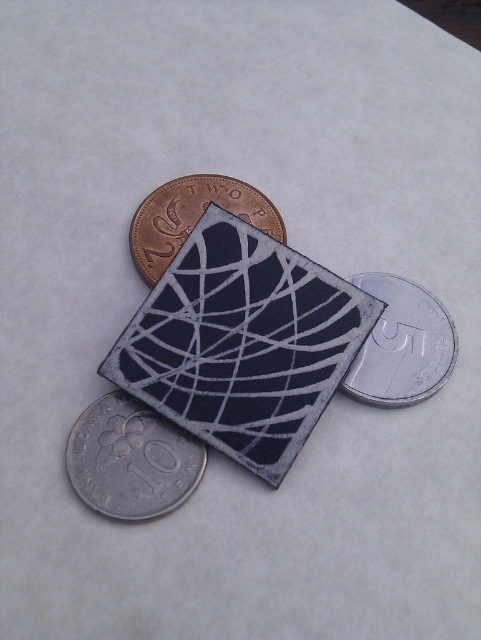
Question: Estimate the real-world distances between objects in this image. Which object is closer to the silver metallic coin at lower left?

Choices:
 (A) silver metallic coin at right
 (B) brass metallic coin at upper left

Answer: (B)

Question: Which object is closer to the camera taking this photo?

Choices:
 (A) brass metallic coin at upper left
 (B) silver metallic coin at lower left

Answer: (B)

Question: From the image, what is the correct spatial relationship of silver metallic coin at lower left in relation to brass metallic coin at upper left?

Choices:
 (A) right
 (B) left

Answer: (B)

Question: Is silver metallic coin at lower left further to camera compared to brass metallic coin at upper left?

Choices:
 (A) no
 (B) yes

Answer: (A)

Question: Which of these objects is positioned farthest from the silver metallic coin at right?

Choices:
 (A) brass metallic coin at upper left
 (B) silver metallic coin at lower left

Answer: (B)

Question: Is silver metallic coin at lower left behind silver metallic coin at right?

Choices:
 (A) no
 (B) yes

Answer: (A)